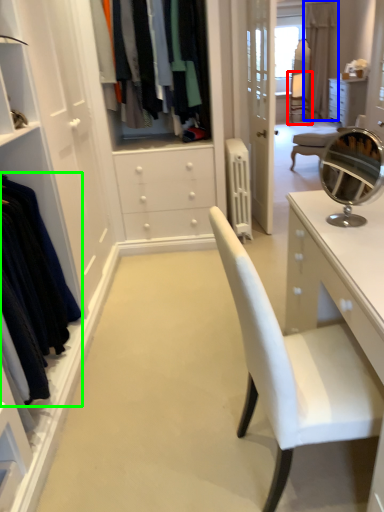
Question: Which object is positioned farthest from armchair (highlighted by a red box)? Select from curtain (highlighted by a blue box) and clothing (highlighted by a green box).

Choices:
 (A) curtain
 (B) clothing

Answer: (B)